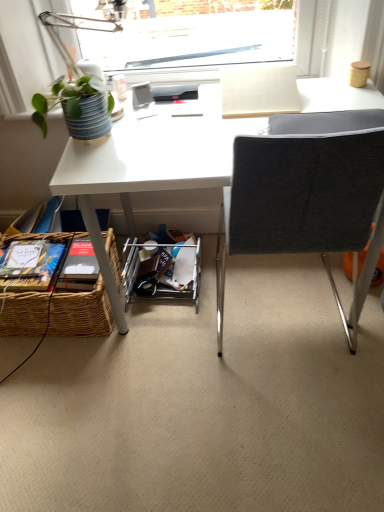
Question: From the image's perspective, is woven brown picnic basket at lower left above or below metal/mesh shelf at lower center?

Choices:
 (A) above
 (B) below

Answer: (B)

Question: Considering the positions of woven brown picnic basket at lower left and metal/mesh shelf at lower center in the image, is woven brown picnic basket at lower left taller or shorter than metal/mesh shelf at lower center?

Choices:
 (A) short
 (B) tall

Answer: (B)

Question: Based on their relative distances, which object is farther from the woven brown picnic basket at lower left?

Choices:
 (A) dark gray fabric chair at center
 (B) green matte plant at upper left
 (C) metal/mesh shelf at lower center
 (D) matte white table lamp at upper left

Answer: (A)

Question: Which of these objects is positioned farthest from the green matte plant at upper left?

Choices:
 (A) dark gray fabric chair at center
 (B) metal/mesh shelf at lower center
 (C) matte white table lamp at upper left
 (D) woven brown picnic basket at lower left

Answer: (B)